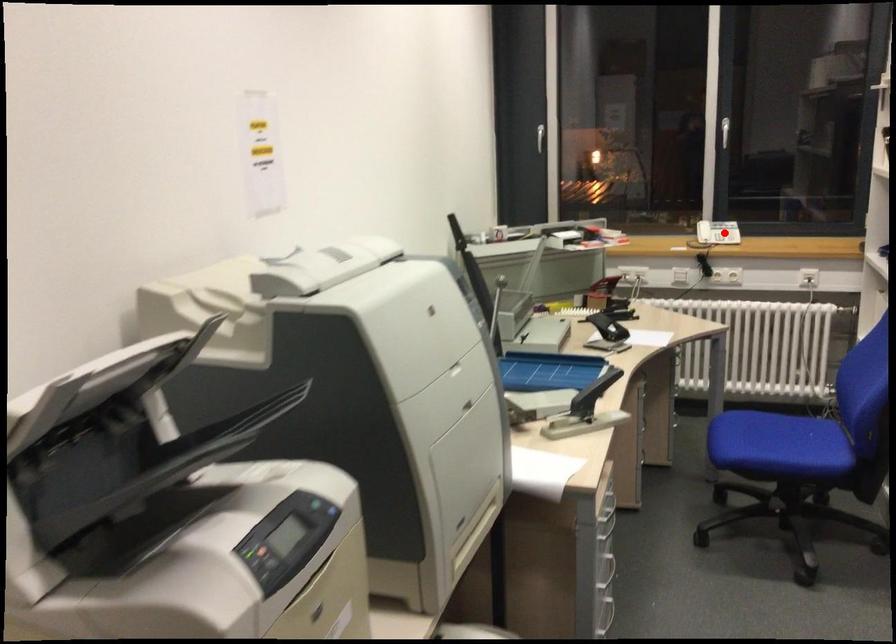
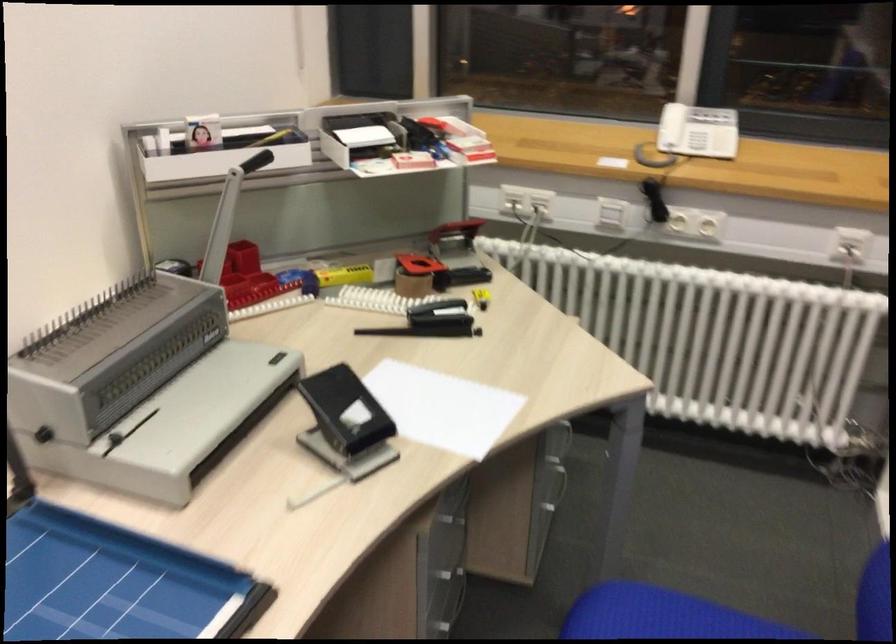
Question: I am providing you with two images of the same scene from different viewpoints. A red point is shown in image1. For the corresponding object point in image2, is it positioned nearer or farther from the camera?

Choices:
 (A) Nearer
 (B) Farther

Answer: (A)